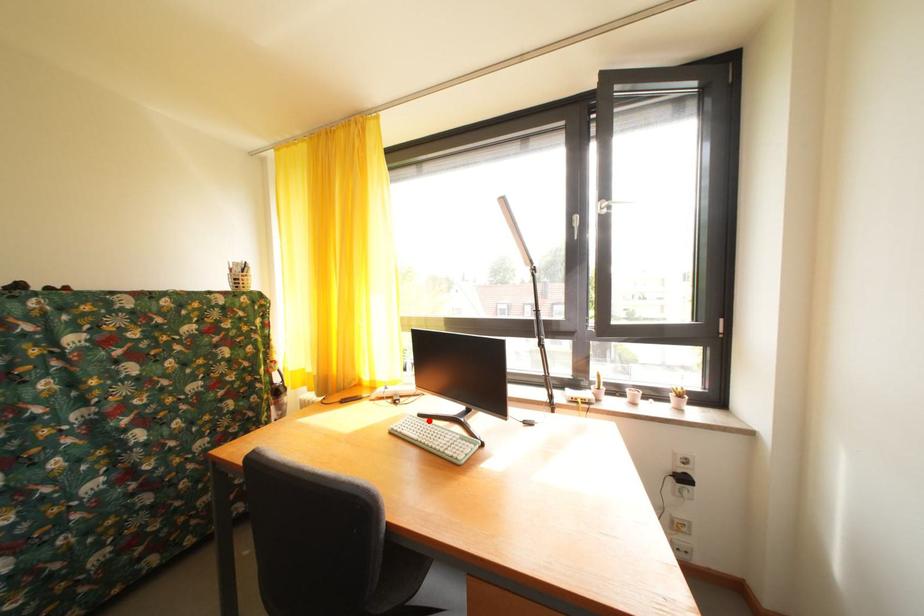
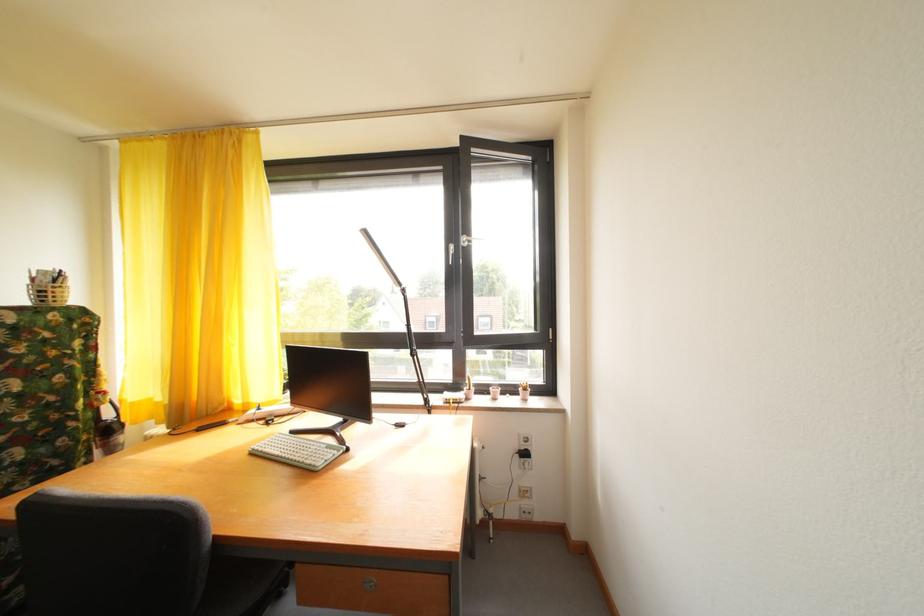
Where in the second image is the point corresponding to the highlighted location from the first image?

(301, 438)